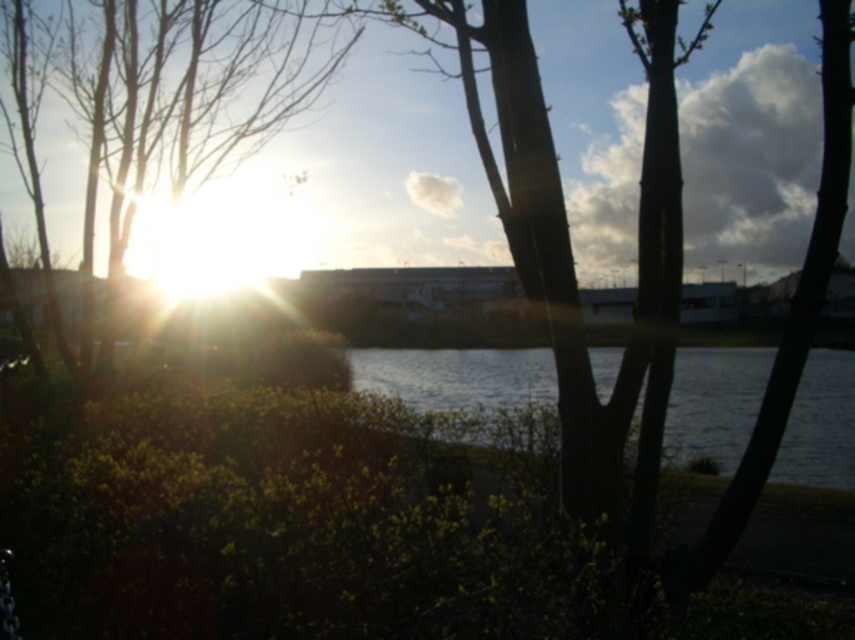
Question: From the image, what is the correct spatial relationship of bare branches at left in relation to silvery reflective water at center?

Choices:
 (A) above
 (B) below

Answer: (A)

Question: Among these points, which one is farthest from the camera?

Choices:
 (A) (517, 371)
 (B) (86, 74)

Answer: (A)

Question: Is bare branches at left bigger than silvery reflective water at center?

Choices:
 (A) no
 (B) yes

Answer: (A)

Question: Can you confirm if bare branches at left is positioned below silvery reflective water at center?

Choices:
 (A) no
 (B) yes

Answer: (A)